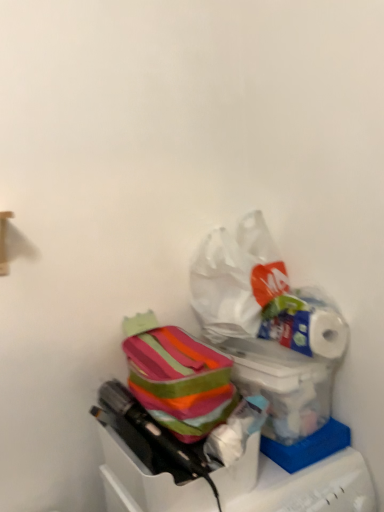
Identify the location of free space between white glossy toilet paper at upper right and white plastic bag at upper center. The image size is (384, 512). (273, 356).